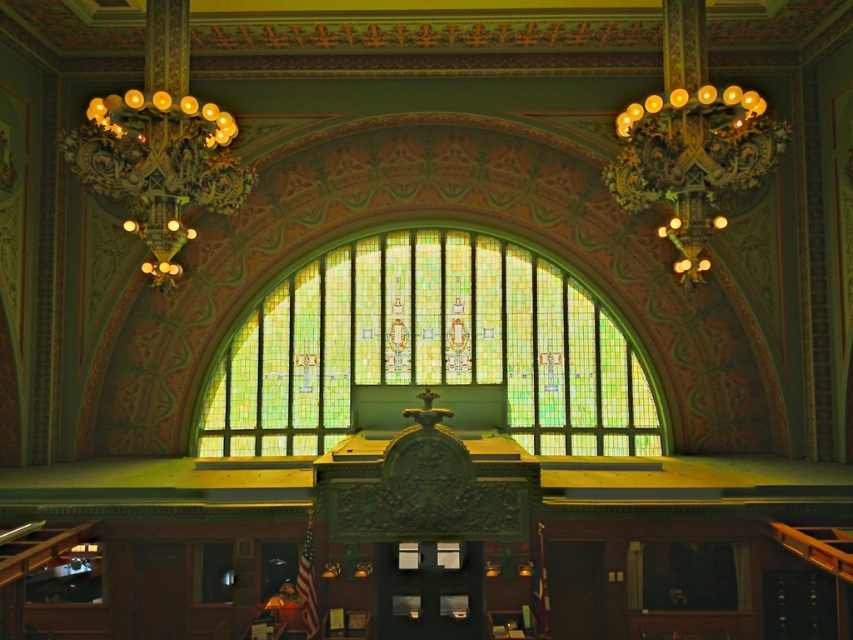
Question: Is stained glass window at center thinner than gold metallic chandelier at upper right?

Choices:
 (A) no
 (B) yes

Answer: (A)

Question: Does stained glass window at center appear on the left side of gold metallic chandelier at upper left?

Choices:
 (A) yes
 (B) no

Answer: (B)

Question: Which of the following is the closest to the observer?

Choices:
 (A) gold metallic chandelier at upper right
 (B) stained glass window at center

Answer: (A)

Question: Which point is farther to the camera?

Choices:
 (A) gold metallic chandelier at upper left
 (B) stained glass window at center

Answer: (B)

Question: Estimate the real-world distances between objects in this image. Which object is farther from the stained glass window at center?

Choices:
 (A) gold metallic chandelier at upper right
 (B) gold metallic chandelier at upper left

Answer: (B)

Question: Is stained glass window at center below gold metallic chandelier at upper left?

Choices:
 (A) no
 (B) yes

Answer: (B)